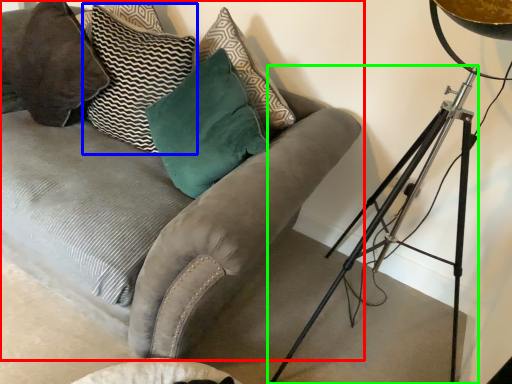
Question: Which object is positioned closest to studio couch (highlighted by a red box)? Select from pillow (highlighted by a blue box) and tripod (highlighted by a green box).

Choices:
 (A) pillow
 (B) tripod

Answer: (A)